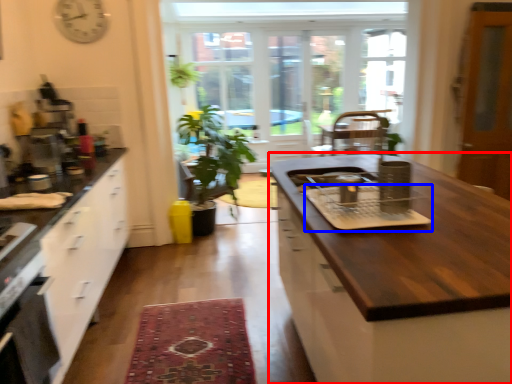
Question: Which point is closer to the camera, cabinetry (highlighted by a red box) or appliance (highlighted by a blue box)?

Choices:
 (A) cabinetry
 (B) appliance

Answer: (A)